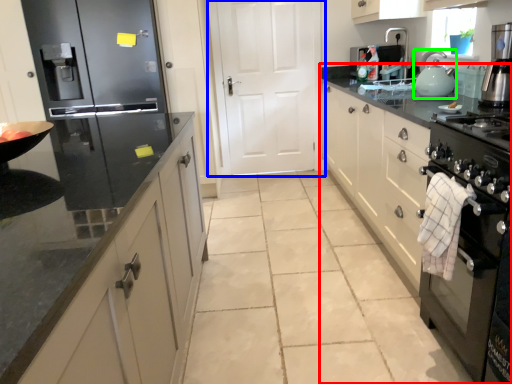
Question: Estimate the real-world distances between objects in this image. Which object is closer to countertop (highlighted by a red box), door (highlighted by a blue box) or kitchen appliance (highlighted by a green box)?

Choices:
 (A) door
 (B) kitchen appliance

Answer: (B)